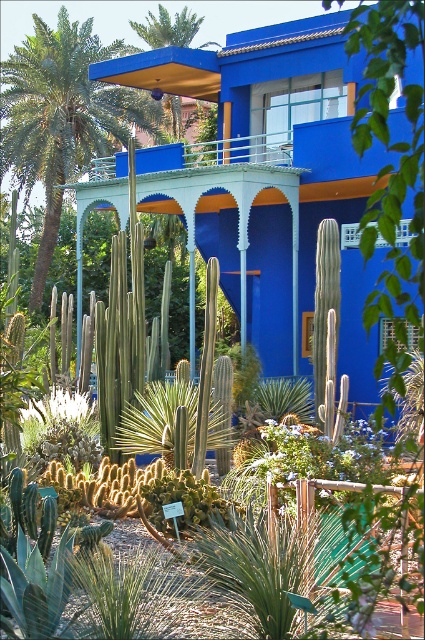
Measure the distance from green leafy palm tree at upper left to green leafy palm tree at upper center.

green leafy palm tree at upper left is 7.79 meters from green leafy palm tree at upper center.

This screenshot has height=640, width=425. What do you see at coordinates (62, 116) in the screenshot?
I see `green leafy palm tree at upper left` at bounding box center [62, 116].

Is point (44, 24) in front of point (172, 44)?

Yes, it is.

The height and width of the screenshot is (640, 425). In order to click on green leafy palm tree at upper left in this screenshot , I will do `click(62, 116)`.